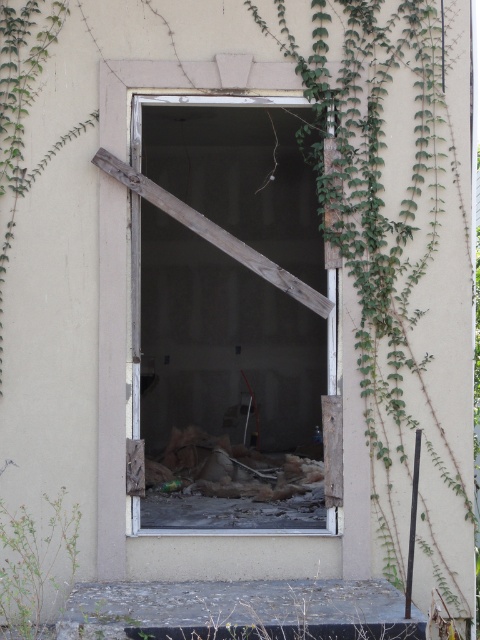
You are standing in front of the abandoned doorway. There is a wooden door at center. Where is the wooden door located in relation to the point at coordinates (226, 388)?

The wooden door at center is located exactly at the point indicated by coordinates (226, 388).

You are a delivery person trying to enter through the wooden door at center. However, you notice a green leafy plant at lower left nearby. Which object is larger in size?

The wooden door at center is bigger than the green leafy plant at lower left, so the wooden door at center is larger in size.

You are standing in front of the abandoned doorway and notice a green leafy plant at lower left and a wooden door at center. Which object is positioned closer to the left side of the scene?

The green leafy plant at lower left is positioned closer to the left side of the scene than the wooden door at center.